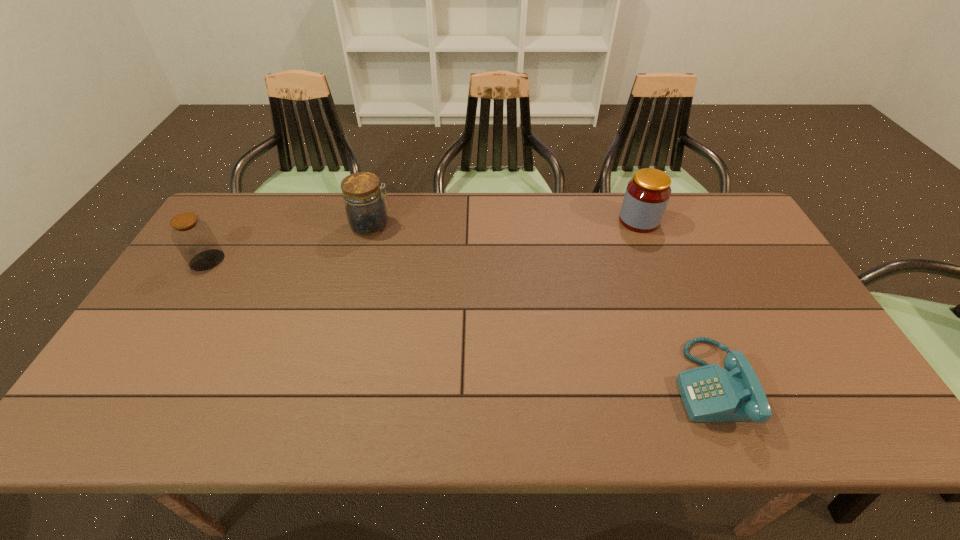
Find the location of a particular element. The height and width of the screenshot is (540, 960). vacant space that's between the third farthest object and the nearest object is located at coordinates (459, 322).

This screenshot has height=540, width=960. In order to click on empty space that is in between the telephone and the second object from left to right in this screenshot , I will do `click(541, 304)`.

Where is `the closest object to the rightmost jar`? The width and height of the screenshot is (960, 540). the closest object to the rightmost jar is located at coordinates (710, 393).

Where is `object that is the third closest to the nearest jar`? The image size is (960, 540). object that is the third closest to the nearest jar is located at coordinates (710, 393).

Identify the location of jar that stands as the second closest to the telephone. The image size is (960, 540). (365, 207).

Locate an element on the screen. The height and width of the screenshot is (540, 960). jar that is the second closest one to the rightmost jar is located at coordinates (194, 239).

Where is `free space that satisfies the following two spatial constraints: 1. on the lid of the second object from left to right; 2. on the front side of the leftmost jar`? Image resolution: width=960 pixels, height=540 pixels. free space that satisfies the following two spatial constraints: 1. on the lid of the second object from left to right; 2. on the front side of the leftmost jar is located at coordinates (362, 260).